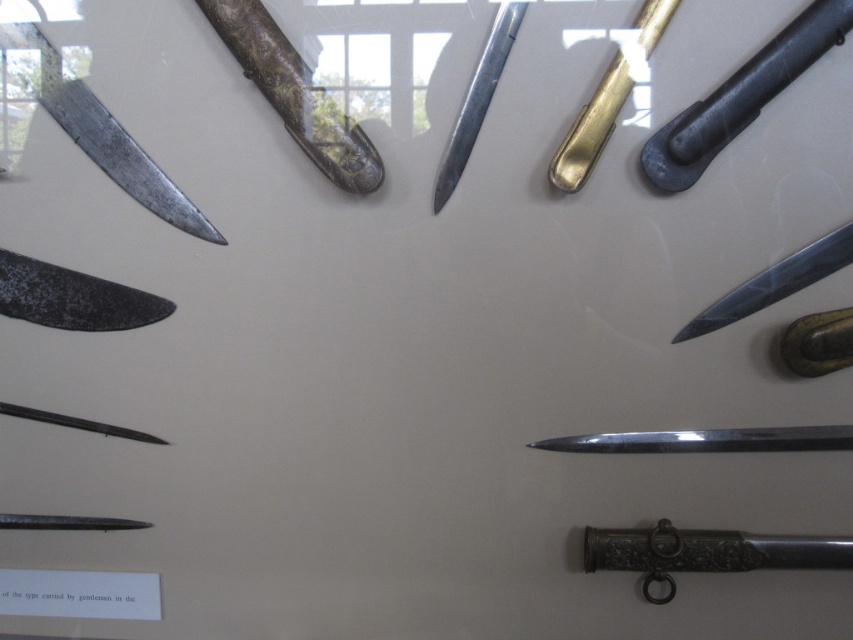
Question: Which object is positioned farthest from the polished dark metal sword at bottom right?

Choices:
 (A) polished silver sword at upper center
 (B) gold polished sword at upper center
 (C) rusty metal sword at upper left
 (D) polished silver dagger at lower center

Answer: (C)

Question: Is black matte sword at upper right above polished silver dagger at lower center?

Choices:
 (A) yes
 (B) no

Answer: (A)

Question: Which point is closer to the camera?

Choices:
 (A) polished silver sword at upper center
 (B) polished dark metal sword at bottom right
 (C) polished silver dagger at lower center

Answer: (A)

Question: Among these points, which one is farthest from the camera?

Choices:
 (A) (593, 552)
 (B) (727, 83)
 (C) (712, 444)
 (D) (599, 154)

Answer: (A)

Question: Is black matte sword at upper right thinner than shiny silver knife at right?

Choices:
 (A) yes
 (B) no

Answer: (B)

Question: Can you confirm if shiny silver blade at upper left is smaller than polished silver sword at upper center?

Choices:
 (A) no
 (B) yes

Answer: (A)